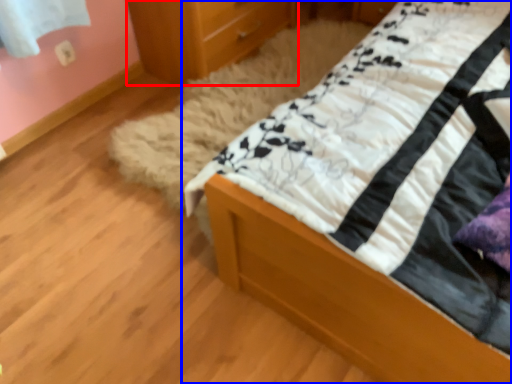
Question: Which object is closer to the camera taking this photo, chest of drawers (highlighted by a red box) or bed (highlighted by a blue box)?

Choices:
 (A) chest of drawers
 (B) bed

Answer: (B)